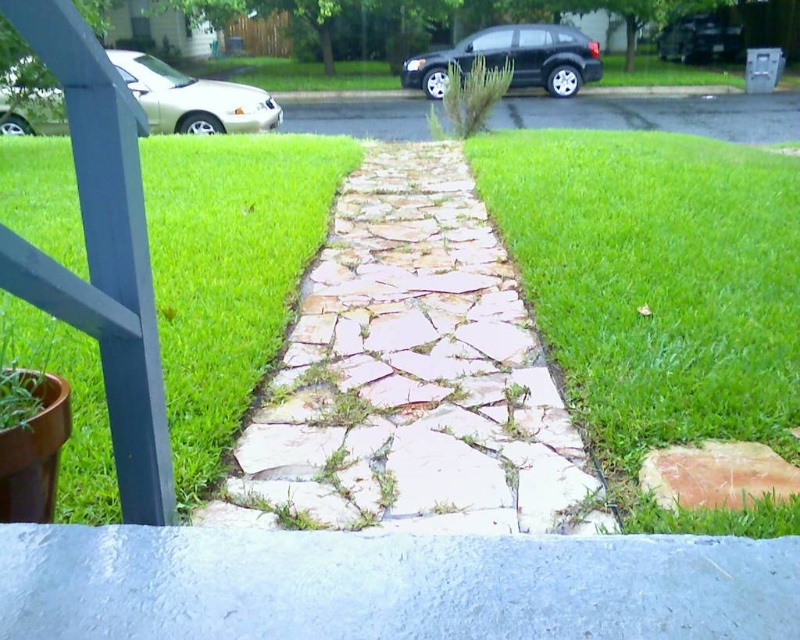
You are driving a car and want to exit the driveway shown in the image. The silver metallic sedan at upper left and the black matte car at upper center are blocking your path. Which car should you move first to clear the path?

The silver metallic sedan at upper left is in front of the black matte car at upper center, so you should move the silver metallic sedan at upper left first to clear the path.

You are standing at the porch and want to walk to the street. Which direction should you go relative to the green grass at left?

The green grass at left is located at point (228, 272), so you should walk towards the right of the green grass at left to reach the street since the pathway leads towards the street direction opposite to the grass location.